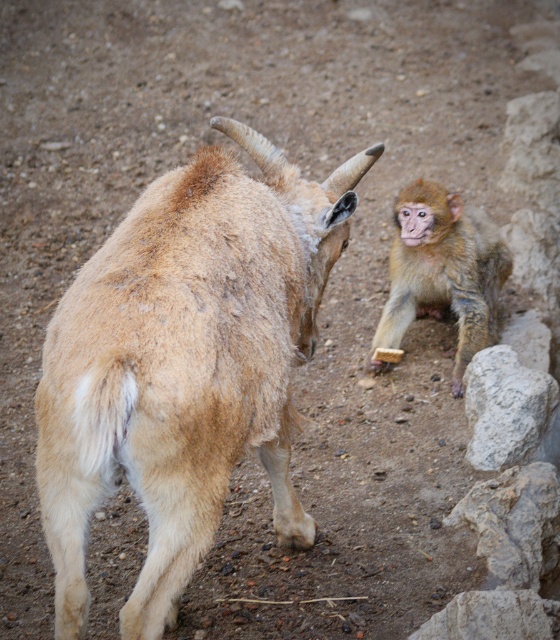
You are standing in front of the image and want to touch the two points mentioned. Which point, point (53,419) or point (389,333), would require you to reach out less to touch it?

Point (53,419) is closer to the viewer than point (389,333), so you would need to reach out less to touch point (53,419).

You are an animal caretaker who needs to place both the brown woolen goat at center and the light brown fur monkey at right into a pen that is 3 meters wide. The goat requires a minimum of 2 meters of space, and the monkey needs at least 1 meter. Can both animals fit in the pen if placed side by side?

The brown woolen goat at center is larger in width than the light brown fur monkey at right. Since the goat requires a minimum of 2 meters and the monkey needs 1 meter, their combined space requirement is 3 meters. The pen is exactly 3 meters wide, so they can fit if placed side by side without overlapping.

You are a wildlife photographer trying to capture a photo of the brown woolen goat at center and the light brown fur monkey at right. Your camera has a maximum focus range of 5 feet. Will you be able to capture both animals in focus at the same time?

The brown woolen goat at center and the light brown fur monkey at right are 4.92 feet apart. Since the distance between them is within the camera maximum focus range of 5 feet, you can capture both animals in focus at the same time.